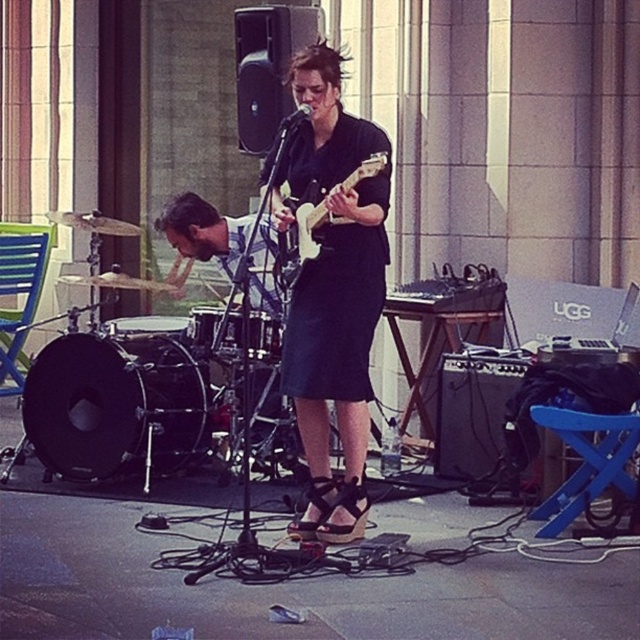
Question: Does matte black guitar at center have a smaller size compared to black matte microphone at center?

Choices:
 (A) no
 (B) yes

Answer: (A)

Question: Which point is farther to the camera?

Choices:
 (A) (284, 116)
 (B) (272, 177)
 (C) (371, 154)

Answer: (A)

Question: Which point is farther from the camera taking this photo?

Choices:
 (A) tap(300, 104)
 (B) tap(378, 154)

Answer: (A)

Question: Does matte black guitar at center have a greater width compared to white glossy electric guitar at center?

Choices:
 (A) yes
 (B) no

Answer: (A)

Question: Which point is closer to the camera?

Choices:
 (A) (362, 353)
 (B) (360, 176)

Answer: (B)

Question: Does matte black guitar at center appear on the left side of white glossy electric guitar at center?

Choices:
 (A) no
 (B) yes

Answer: (B)